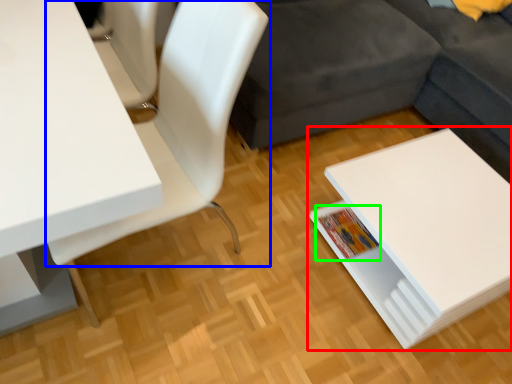
Question: Considering the real-world distances, which object is farthest from table (highlighted by a red box)? chair (highlighted by a blue box) or book (highlighted by a green box)?

Choices:
 (A) chair
 (B) book

Answer: (A)